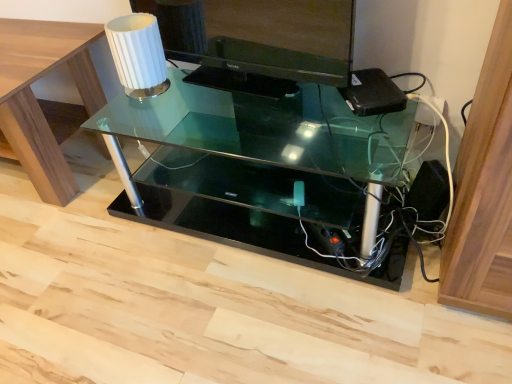
What do you see at coordinates (263, 36) in the screenshot? The width and height of the screenshot is (512, 384). I see `black glossy monitor at upper center` at bounding box center [263, 36].

Locate an element on the screen. clear glass table at upper left, the first table from the left is located at coordinates (36, 99).

Would you say black glossy monitor at upper center is part of clear glass table at upper left, the first table from the left,'s contents?

No, black glossy monitor at upper center is not a part of clear glass table at upper left, the first table from the left.

Considering the relative sizes of clear glass table at upper left, positioned as the second table in right-to-left order, and black glossy monitor at upper center in the image provided, is clear glass table at upper left, positioned as the second table in right-to-left order, smaller than black glossy monitor at upper center?

No.

Measure the distance between clear glass table at upper left, positioned as the second table in right-to-left order, and black glossy monitor at upper center.

clear glass table at upper left, positioned as the second table in right-to-left order, is 19.49 inches away from black glossy monitor at upper center.

Does clear glass table at upper left, the first table from the left, have a greater height compared to black glossy monitor at upper center?

Yes.

Can you confirm if transparent glass table at center, which is counted as the 2th table, starting from the left, is shorter than clear glass table at upper left, positioned as the second table in right-to-left order?

Yes, transparent glass table at center, which is counted as the 2th table, starting from the left, is shorter than clear glass table at upper left, positioned as the second table in right-to-left order.

Considering the sizes of objects transparent glass table at center, which appears as the 1th table when viewed from the right, and clear glass table at upper left, the first table from the left, in the image provided, who is thinner, transparent glass table at center, which appears as the 1th table when viewed from the right, or clear glass table at upper left, the first table from the left,?

transparent glass table at center, which appears as the 1th table when viewed from the right.

Considering the positions of objects transparent glass table at center, which appears as the 1th table when viewed from the right, and clear glass table at upper left, the first table from the left, in the image provided, who is more to the left, transparent glass table at center, which appears as the 1th table when viewed from the right, or clear glass table at upper left, the first table from the left,?

From the viewer's perspective, clear glass table at upper left, the first table from the left, appears more on the left side.

Is transparent glass table at center, which is counted as the 2th table, starting from the left, facing towards clear glass table at upper left, the first table from the left?

No, transparent glass table at center, which is counted as the 2th table, starting from the left, is not facing towards clear glass table at upper left, the first table from the left.

Does point (163, 14) appear closer or farther from the camera than point (55, 44)?

Point (163, 14) is positioned closer to the camera compared to point (55, 44).

Can you confirm if black glossy monitor at upper center is shorter than clear glass table at upper left, the first table from the left?

Yes, black glossy monitor at upper center is shorter than clear glass table at upper left, the first table from the left.

From the image's perspective, is black glossy monitor at upper center below clear glass table at upper left, the first table from the left?

No.

Can you confirm if black glossy monitor at upper center is smaller than clear glass table at upper left, positioned as the second table in right-to-left order?

Correct, black glossy monitor at upper center occupies less space than clear glass table at upper left, positioned as the second table in right-to-left order.

In terms of size, does transparent glass table at center, which appears as the 1th table when viewed from the right, appear bigger or smaller than white ribbed glass at upper left?

transparent glass table at center, which appears as the 1th table when viewed from the right, is bigger than white ribbed glass at upper left.

At what (x,y) coordinates should I click in order to perform the action: click on table in front of the white ribbed glass at upper left. Please return your answer as a coordinate pair (x, y). Looking at the image, I should click on (262, 170).

Can you tell me how much transparent glass table at center, which is counted as the 2th table, starting from the left, and white ribbed glass at upper left differ in facing direction?

The angular difference between transparent glass table at center, which is counted as the 2th table, starting from the left, and white ribbed glass at upper left is 5.81 degrees.

From a real-world perspective, is transparent glass table at center, which is counted as the 2th table, starting from the left, positioned under white ribbed glass at upper left based on gravity?

Correct, in the physical world, transparent glass table at center, which is counted as the 2th table, starting from the left, is lower than white ribbed glass at upper left.

Which point is more forward, (263, 101) or (251, 31)?

Positioned in front is point (251, 31).

Considering the positions of objects transparent glass table at center, which appears as the 1th table when viewed from the right, and black glossy monitor at upper center in the image provided, who is more to the right, transparent glass table at center, which appears as the 1th table when viewed from the right, or black glossy monitor at upper center?

From the viewer's perspective, transparent glass table at center, which appears as the 1th table when viewed from the right, appears more on the right side.

From a real-world perspective, is transparent glass table at center, which appears as the 1th table when viewed from the right, positioned above or below black glossy monitor at upper center?

From a real-world perspective, transparent glass table at center, which appears as the 1th table when viewed from the right, is physically below black glossy monitor at upper center.

Identify the location of computer monitor above the transparent glass table at center, which appears as the 1th table when viewed from the right (from the image's perspective). pos(263,36).

Is clear glass table at upper left, positioned as the second table in right-to-left order, next to white ribbed glass at upper left and touching it?

No, clear glass table at upper left, positioned as the second table in right-to-left order, is not in contact with white ribbed glass at upper left.

Image resolution: width=512 pixels, height=384 pixels. In order to click on table lamp to the right of clear glass table at upper left, the first table from the left in this screenshot , I will do `click(138, 54)`.

Could you tell me if clear glass table at upper left, the first table from the left, is facing white ribbed glass at upper left?

No, clear glass table at upper left, the first table from the left, is not turned towards white ribbed glass at upper left.

Is point (40, 143) closer or farther from the camera than point (166, 70)?

Clearly, point (40, 143) is more distant from the camera than point (166, 70).

Is white ribbed glass at upper left far from black glossy monitor at upper center?

No, white ribbed glass at upper left is not far from black glossy monitor at upper center.

Is black glossy monitor at upper center at the back of white ribbed glass at upper left?

Correct, white ribbed glass at upper left is looking away from black glossy monitor at upper center.

Which is behind, white ribbed glass at upper left or black glossy monitor at upper center?

Positioned behind is white ribbed glass at upper left.

From a real-world perspective, between white ribbed glass at upper left and black glossy monitor at upper center, who is vertically higher?

black glossy monitor at upper center.

Image resolution: width=512 pixels, height=384 pixels. What are the coordinates of `table behind the black glossy monitor at upper center` in the screenshot? It's located at (36, 99).

Locate an element on the screen. Image resolution: width=512 pixels, height=384 pixels. table that is on the left side of transparent glass table at center, which is counted as the 2th table, starting from the left is located at coordinates (36, 99).

Based on their spatial positions, is clear glass table at upper left, the first table from the left, or transparent glass table at center, which is counted as the 2th table, starting from the left, closer to white ribbed glass at upper left?

clear glass table at upper left, the first table from the left, lies closer to white ribbed glass at upper left than the other object.

Which object lies nearer to the anchor point black glossy monitor at upper center, white ribbed glass at upper left or clear glass table at upper left, the first table from the left?

Among the two, white ribbed glass at upper left is located nearer to black glossy monitor at upper center.

When comparing their distances from white ribbed glass at upper left, does black glossy monitor at upper center or transparent glass table at center, which is counted as the 2th table, starting from the left, seem closer?

The object closer to white ribbed glass at upper left is black glossy monitor at upper center.

From the image, which object appears to be farther from black glossy monitor at upper center, transparent glass table at center, which appears as the 1th table when viewed from the right, or white ribbed glass at upper left?

Based on the image, transparent glass table at center, which appears as the 1th table when viewed from the right, appears to be further to black glossy monitor at upper center.

Which object lies nearer to the anchor point transparent glass table at center, which appears as the 1th table when viewed from the right, white ribbed glass at upper left or clear glass table at upper left, positioned as the second table in right-to-left order?

white ribbed glass at upper left.

From the image, which object appears to be farther from clear glass table at upper left, positioned as the second table in right-to-left order, black glossy monitor at upper center or white ribbed glass at upper left?

The object further to clear glass table at upper left, positioned as the second table in right-to-left order, is black glossy monitor at upper center.

Based on their spatial positions, is clear glass table at upper left, the first table from the left, or black glossy monitor at upper center further from transparent glass table at center, which appears as the 1th table when viewed from the right?

clear glass table at upper left, the first table from the left.

Estimate the real-world distances between objects in this image. Which object is further from clear glass table at upper left, positioned as the second table in right-to-left order, white ribbed glass at upper left or black glossy monitor at upper center?

black glossy monitor at upper center.

The height and width of the screenshot is (384, 512). I want to click on table lamp between clear glass table at upper left, positioned as the second table in right-to-left order, and transparent glass table at center, which is counted as the 2th table, starting from the left, from left to right, so click(138, 54).

Identify the location of computer monitor between white ribbed glass at upper left and transparent glass table at center, which appears as the 1th table when viewed from the right, in the horizontal direction. (263, 36).

You are a GUI agent. You are given a task and a screenshot of the screen. Output one action in this format:
    pyautogui.click(x=<x>, y=<y>)
    Task: Click on the computer monitor between clear glass table at upper left, the first table from the left, and transparent glass table at center, which is counted as the 2th table, starting from the left
    The height and width of the screenshot is (384, 512).
    Given the screenshot: What is the action you would take?
    pyautogui.click(x=263, y=36)

At what (x,y) coordinates should I click in order to perform the action: click on table lamp situated between clear glass table at upper left, positioned as the second table in right-to-left order, and black glossy monitor at upper center from left to right. Please return your answer as a coordinate pair (x, y). Looking at the image, I should click on (138, 54).